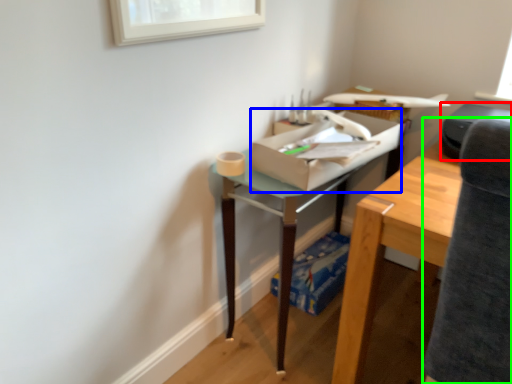
Question: Which object is positioned farthest from printer (highlighted by a red box)? Select from cardboard box (highlighted by a blue box) and swivel chair (highlighted by a green box).

Choices:
 (A) cardboard box
 (B) swivel chair

Answer: (B)